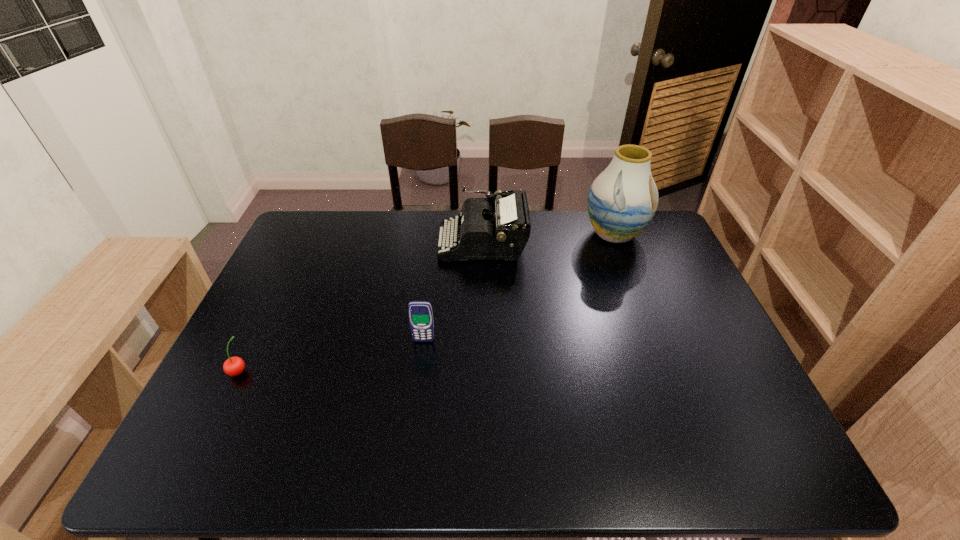
Where is `free space at the right edge of the desktop`? free space at the right edge of the desktop is located at coordinates (642, 256).

Locate an element on the screen. This screenshot has height=540, width=960. free location at the far left corner of the desktop is located at coordinates (343, 224).

Locate an element on the screen. This screenshot has height=540, width=960. unoccupied position between the third farthest object and the vase is located at coordinates (518, 287).

At what (x,y) coordinates should I click in order to perform the action: click on vacant space that is in between the second nearest object and the nearest object. Please return your answer as a coordinate pair (x, y). The height and width of the screenshot is (540, 960). Looking at the image, I should click on (331, 356).

This screenshot has width=960, height=540. What are the coordinates of `free space between the rightmost object and the third farthest object` in the screenshot? It's located at (518, 287).

Identify the location of empty location between the cellular telephone and the rightmost object. Image resolution: width=960 pixels, height=540 pixels. (518, 287).

Find the location of a particular element. The width and height of the screenshot is (960, 540). vacant space in between the leftmost object and the cellular telephone is located at coordinates tap(331, 356).

The width and height of the screenshot is (960, 540). I want to click on empty space that is in between the typewriter and the vase, so pyautogui.click(x=548, y=238).

At what (x,y) coordinates should I click in order to perform the action: click on free space between the third farthest object and the tallest object. Please return your answer as a coordinate pair (x, y). The width and height of the screenshot is (960, 540). Looking at the image, I should click on (518, 287).

Locate an element on the screen. object that ranks as the third closest to the typewriter is located at coordinates (234, 366).